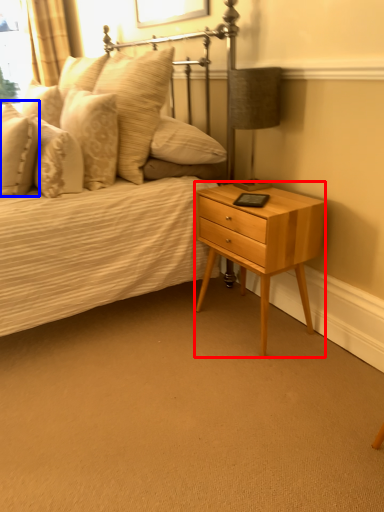
Question: Which of the following is the farthest to the observer, nightstand (highlighted by a red box) or pillow (highlighted by a blue box)?

Choices:
 (A) nightstand
 (B) pillow

Answer: (B)